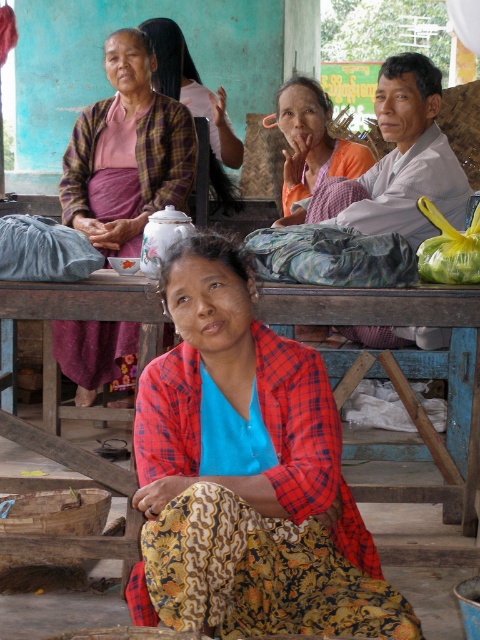
Question: Is plaid fabric shirt at upper left above orange fabric at center?

Choices:
 (A) yes
 (B) no

Answer: (A)

Question: Considering the relative positions of red plaid shirt at center and yellow plastic bag at center in the image provided, where is red plaid shirt at center located with respect to yellow plastic bag at center?

Choices:
 (A) below
 (B) above

Answer: (A)

Question: Which object is farther from the camera taking this photo?

Choices:
 (A) plaid fabric shirt at upper left
 (B) red plaid shirt at center

Answer: (A)

Question: Which point appears closest to the camera in this image?

Choices:
 (A) [x=296, y=221]
 (B) [x=444, y=241]
 (C) [x=231, y=627]

Answer: (C)

Question: Which object is farther from the camera taking this photo?

Choices:
 (A) wooden table at center
 (B) orange fabric at center
 (C) yellow plastic bag at center

Answer: (B)

Question: Is red plaid shirt at center closer to camera compared to plaid fabric shirt at upper left?

Choices:
 (A) yes
 (B) no

Answer: (A)